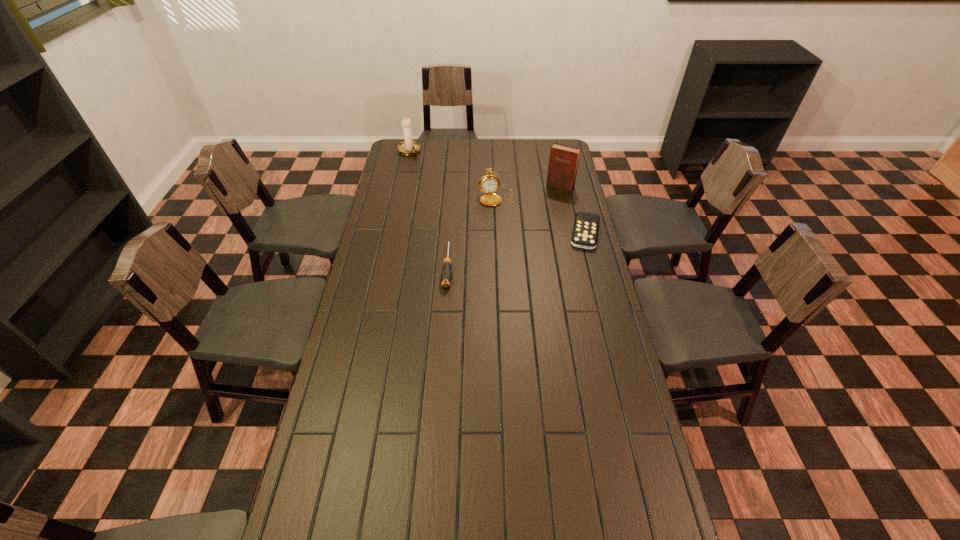
I want to click on object that is positioned at the left edge, so click(x=409, y=147).

Find the location of `remote control present at the right edge`. remote control present at the right edge is located at coordinates (586, 225).

Locate an element on the screen. diary that is at the right edge is located at coordinates (563, 162).

This screenshot has width=960, height=540. I want to click on object that is positioned at the far left corner, so click(409, 147).

At what (x,y) coordinates should I click in order to perform the action: click on free region at the far edge of the desktop. Please return your answer as a coordinate pair (x, y). The height and width of the screenshot is (540, 960). Looking at the image, I should click on point(505,143).

Locate an element on the screen. free region at the near edge is located at coordinates (516, 501).

Locate an element on the screen. vacant region at the left edge is located at coordinates (344, 358).

In the image, there is a desktop. At what (x,y) coordinates should I click in order to perform the action: click on vacant space at the right edge. Please return your answer as a coordinate pair (x, y). This screenshot has height=540, width=960. Looking at the image, I should click on (616, 470).

The width and height of the screenshot is (960, 540). I want to click on vacant space at the far right corner of the desktop, so click(542, 162).

Identify the location of free space between the third shortest object and the farthest object. This screenshot has height=540, width=960. (453, 174).